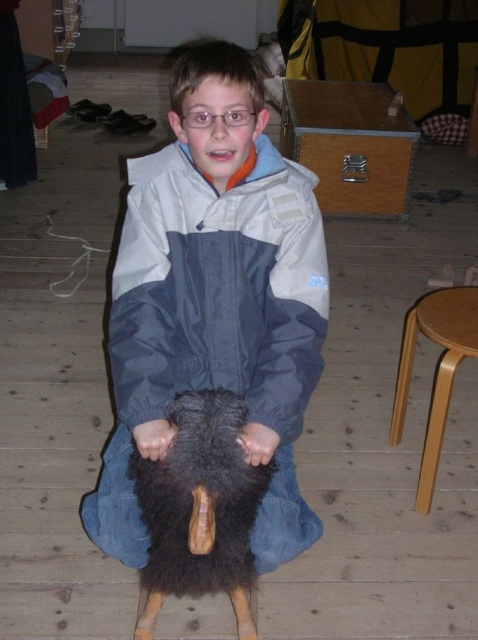
Question: Considering the real-world distances, which object is closest to the light brown wood stool at right?

Choices:
 (A) dark gray fabric jacket at center
 (B) fuzzy black animal at center

Answer: (A)

Question: Which point appears closest to the camera in this image?

Choices:
 (A) (226, 436)
 (B) (447, 376)
 (C) (206, 241)

Answer: (A)

Question: Is dark gray fabric jacket at center below light brown wood stool at right?

Choices:
 (A) yes
 (B) no

Answer: (B)

Question: Among these points, which one is nearest to the camera?

Choices:
 (A) (159, 378)
 (B) (401, 401)

Answer: (A)

Question: Does dark gray fabric jacket at center appear under light brown wood stool at right?

Choices:
 (A) yes
 (B) no

Answer: (B)

Question: Can you confirm if fuzzy black animal at center is positioned to the left of light brown wood stool at right?

Choices:
 (A) yes
 (B) no

Answer: (A)